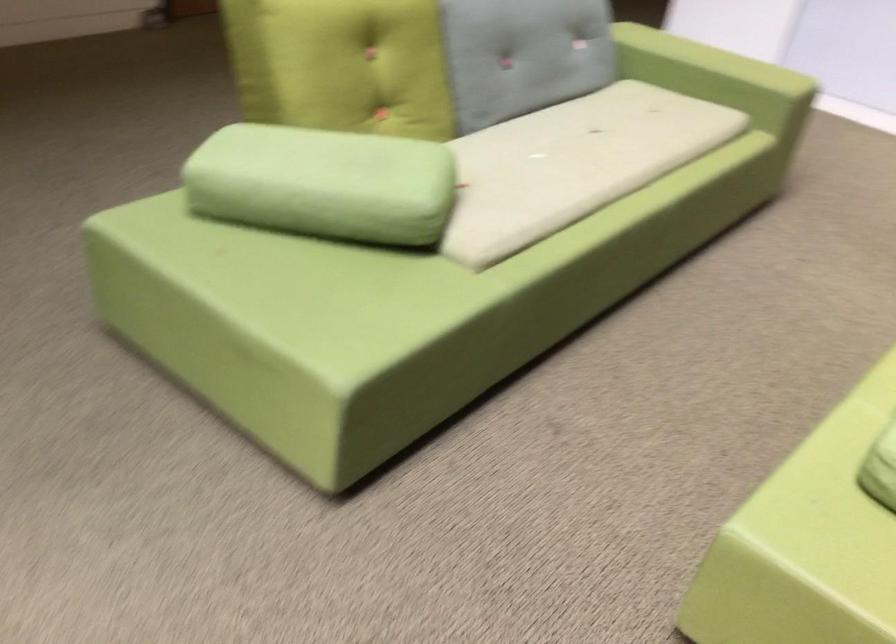
This screenshot has height=644, width=896. I want to click on sofa sitting surface, so click(572, 164).